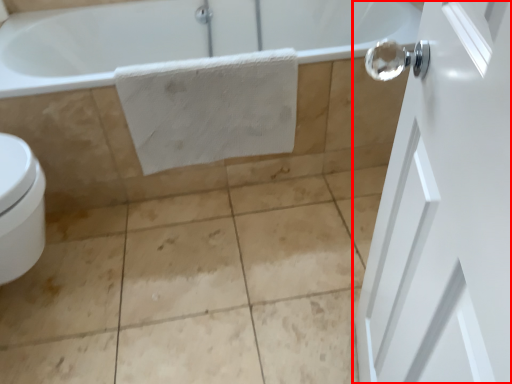
Question: From the image, what is the correct spatial relationship of door (annotated by the red box) in relation to bath towel?

Choices:
 (A) left
 (B) right

Answer: (B)